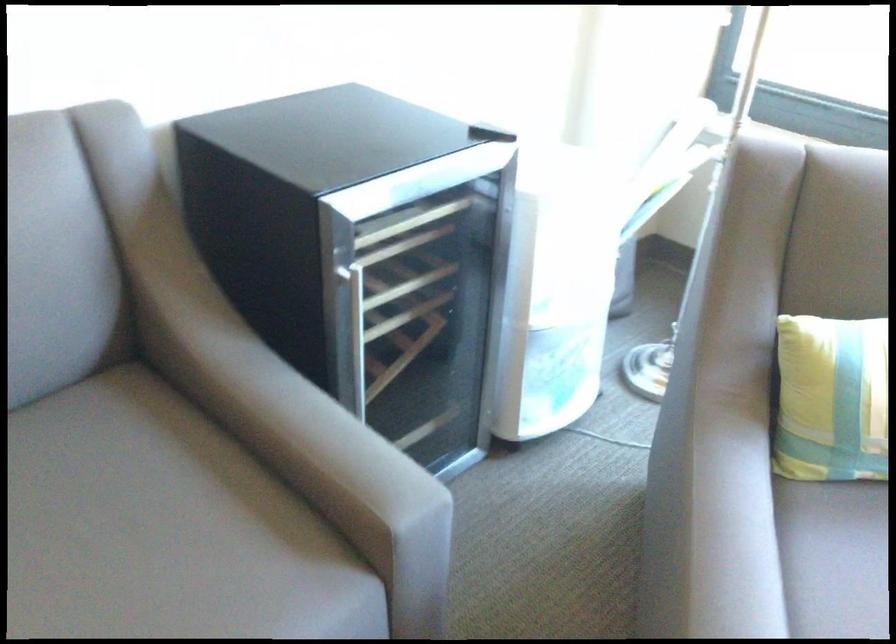
Describe the element at coordinates (357, 333) in the screenshot. The height and width of the screenshot is (644, 896). I see `the fridge door handle` at that location.